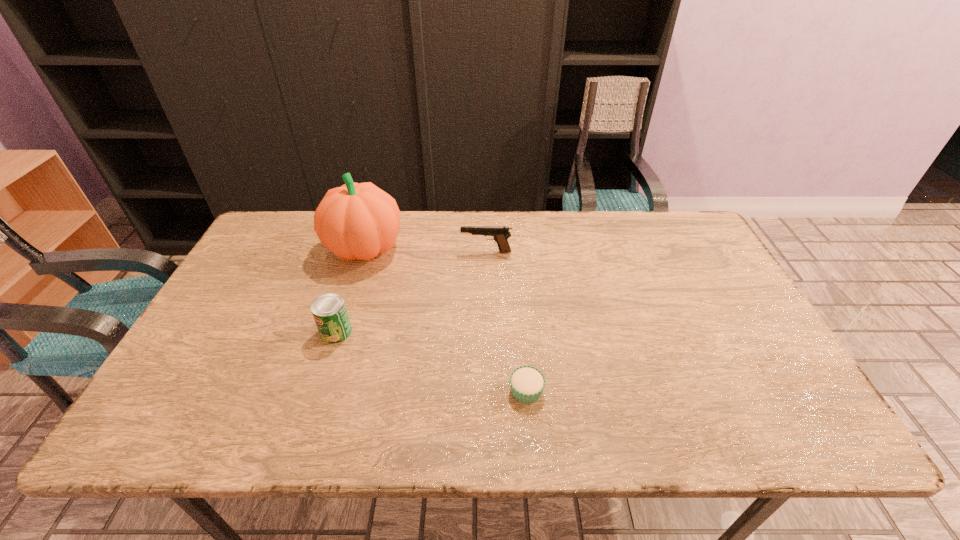
This screenshot has width=960, height=540. Identify the location of unoccupied position between the second nearest object and the pistol. (411, 292).

This screenshot has width=960, height=540. What are the coordinates of `free space between the third farthest object and the cupcake` in the screenshot? It's located at (431, 361).

Where is `free space between the third farthest object and the tallest object`? free space between the third farthest object and the tallest object is located at coordinates (350, 290).

Find the location of `free space between the pistol and the can`. free space between the pistol and the can is located at coordinates (411, 292).

The height and width of the screenshot is (540, 960). In order to click on vacant area that lies between the tallest object and the cupcake in this screenshot , I will do `click(445, 319)`.

Where is `unoccupied position between the pistol and the nearest object`? The width and height of the screenshot is (960, 540). unoccupied position between the pistol and the nearest object is located at coordinates (506, 321).

The height and width of the screenshot is (540, 960). What are the coordinates of `free space between the shortest object and the pistol` in the screenshot? It's located at (506, 321).

This screenshot has width=960, height=540. In order to click on free space that is in between the shortest object and the pistol in this screenshot , I will do `click(506, 321)`.

This screenshot has height=540, width=960. Identify the location of vacant point located between the pistol and the nearest object. (506, 321).

Identify the location of empty space between the pumpkin and the can. The image size is (960, 540). (350, 290).